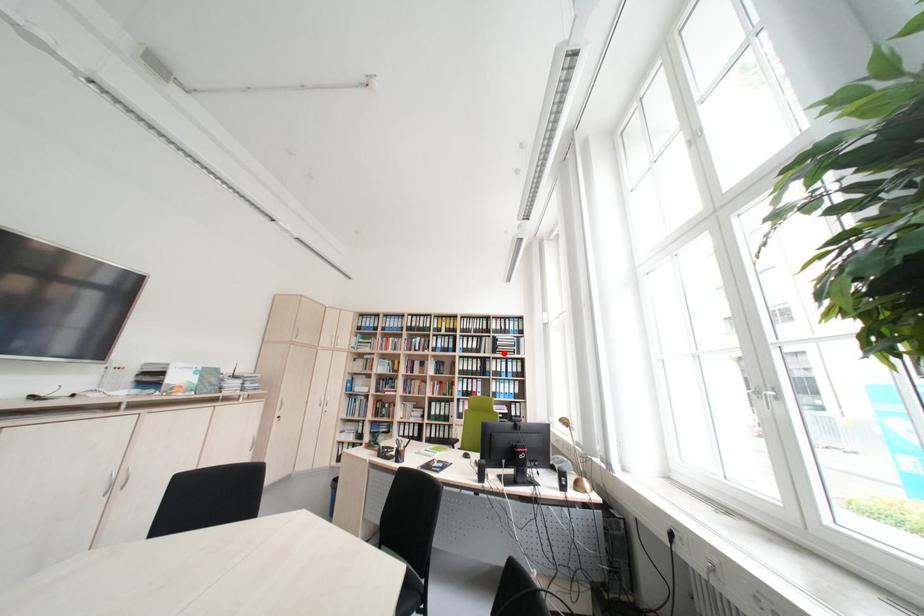
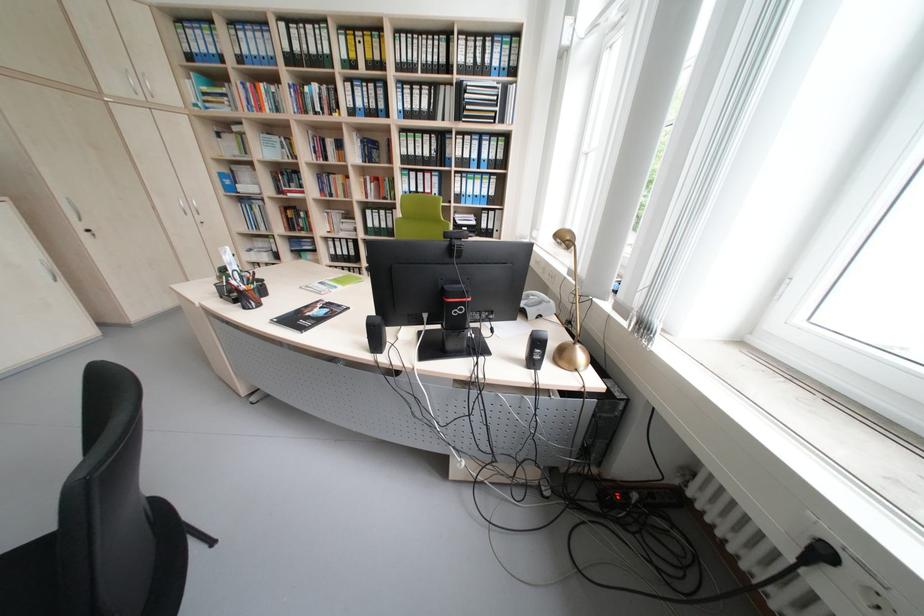
Locate, in the second image, the point that corresponds to the highlighted location in the first image.

(468, 119)